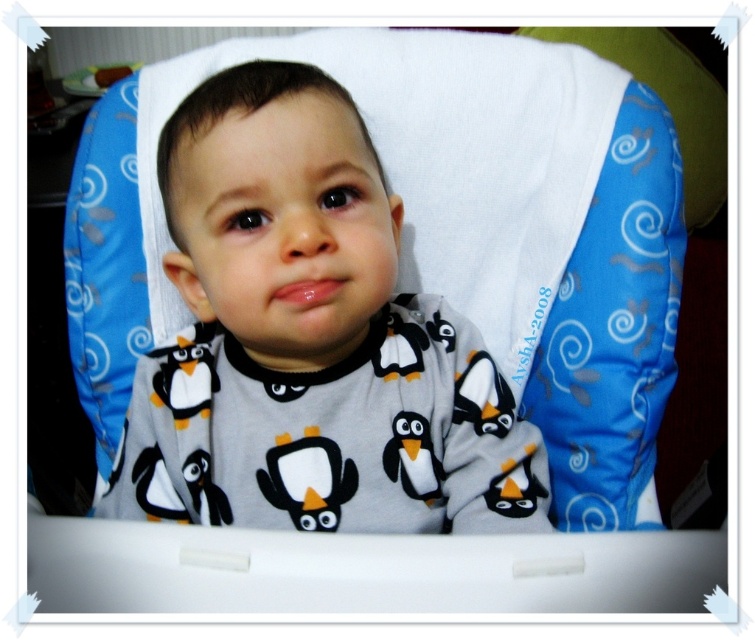
Question: Does gray fleece pajamas at center have a lesser width compared to white plush penguin at center?

Choices:
 (A) no
 (B) yes

Answer: (A)

Question: From the image, what is the correct spatial relationship of gray fleece pajamas at center in relation to white plush penguin at center?

Choices:
 (A) right
 (B) left

Answer: (B)

Question: Estimate the real-world distances between objects in this image. Which object is farther from the white plush penguin at center?

Choices:
 (A) black fabric penguin at center
 (B) gray fleece pajamas at center

Answer: (B)

Question: Among these objects, which one is farthest from the camera?

Choices:
 (A) gray fleece pajamas at center
 (B) white plush penguin at center
 (C) black fabric penguin at center

Answer: (B)

Question: Is gray fleece pajamas at center above black fabric penguin at center?

Choices:
 (A) yes
 (B) no

Answer: (A)

Question: Which object is the farthest from the white plush penguin at center?

Choices:
 (A) black fabric penguin at center
 (B) gray fleece pajamas at center

Answer: (B)